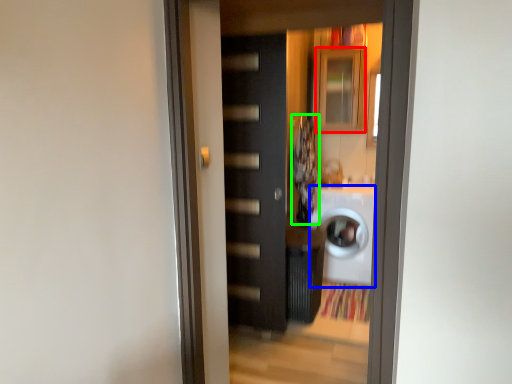
Question: Estimate the real-world distances between objects in this image. Which object is farther from cabinetry (highlighted by a red box), washing machine (highlighted by a blue box) or laundry (highlighted by a green box)?

Choices:
 (A) washing machine
 (B) laundry

Answer: (A)